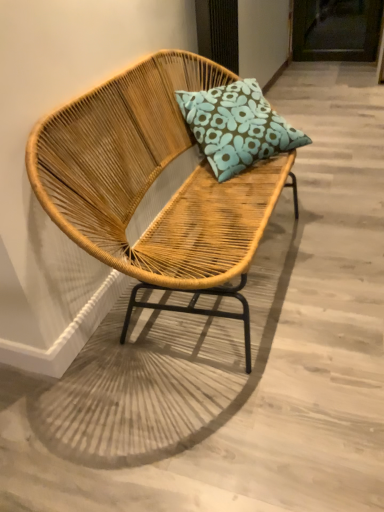
Question: Should I look upward or downward to see blue floral cushion at center?

Choices:
 (A) up
 (B) down

Answer: (A)

Question: Is bamboo woven chair at center closer to the viewer compared to blue floral cushion at center?

Choices:
 (A) yes
 (B) no

Answer: (A)

Question: Does bamboo woven chair at center have a larger size compared to blue floral cushion at center?

Choices:
 (A) yes
 (B) no

Answer: (A)

Question: Considering the relative sizes of bamboo woven chair at center and blue floral cushion at center in the image provided, is bamboo woven chair at center wider than blue floral cushion at center?

Choices:
 (A) yes
 (B) no

Answer: (A)

Question: Can you confirm if bamboo woven chair at center is smaller than blue floral cushion at center?

Choices:
 (A) no
 (B) yes

Answer: (A)

Question: Considering the relative positions of bamboo woven chair at center and blue floral cushion at center in the image provided, is bamboo woven chair at center to the left of blue floral cushion at center from the viewer's perspective?

Choices:
 (A) no
 (B) yes

Answer: (B)

Question: Can you confirm if bamboo woven chair at center is thinner than blue floral cushion at center?

Choices:
 (A) no
 (B) yes

Answer: (A)

Question: Does blue floral cushion at center appear on the right side of bamboo woven chair at center?

Choices:
 (A) no
 (B) yes

Answer: (B)

Question: Is blue floral cushion at center positioned with its back to bamboo woven chair at center?

Choices:
 (A) yes
 (B) no

Answer: (A)

Question: Is blue floral cushion at center located outside bamboo woven chair at center?

Choices:
 (A) yes
 (B) no

Answer: (B)

Question: Does blue floral cushion at center have a smaller size compared to bamboo woven chair at center?

Choices:
 (A) yes
 (B) no

Answer: (A)

Question: Considering the relative sizes of blue floral cushion at center and bamboo woven chair at center in the image provided, is blue floral cushion at center thinner than bamboo woven chair at center?

Choices:
 (A) yes
 (B) no

Answer: (A)

Question: Is blue floral cushion at center at the left side of bamboo woven chair at center?

Choices:
 (A) no
 (B) yes

Answer: (A)

Question: In terms of size, does bamboo woven chair at center appear bigger or smaller than blue floral cushion at center?

Choices:
 (A) small
 (B) big

Answer: (B)